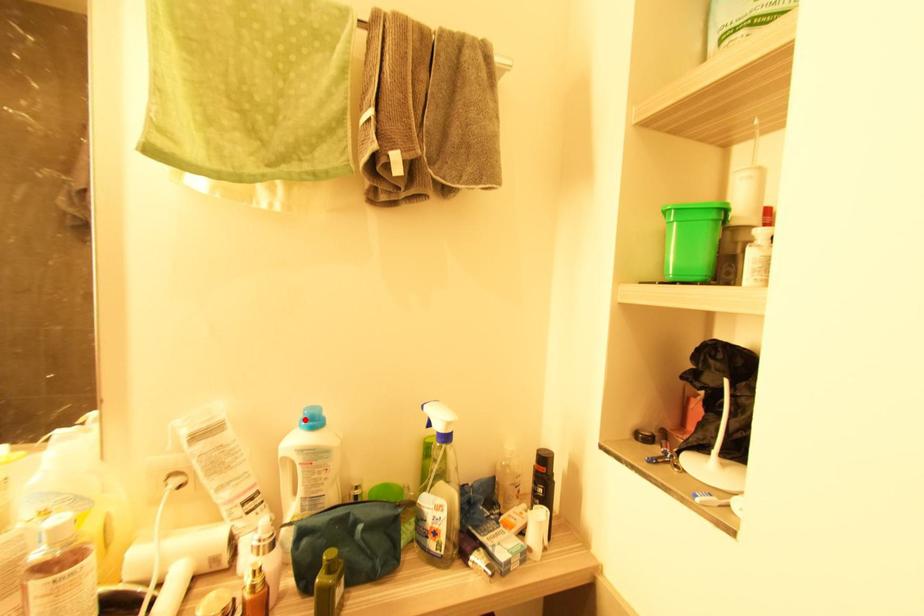
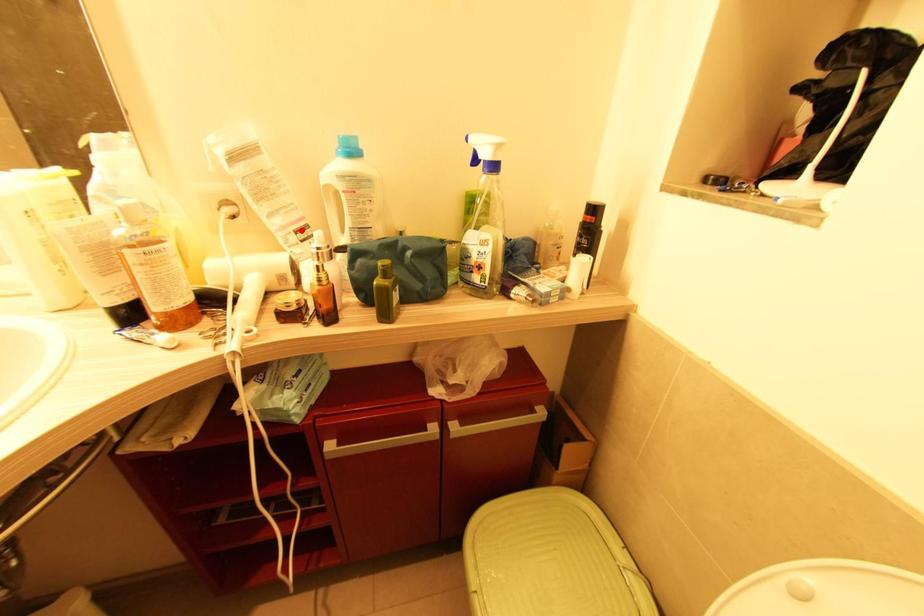
I am providing you with two images of the same scene from different viewpoints. A red point is marked on the first image and another point is marked on the second image. Does the point marked in image1 correspond to the same location as the one in image2?

No